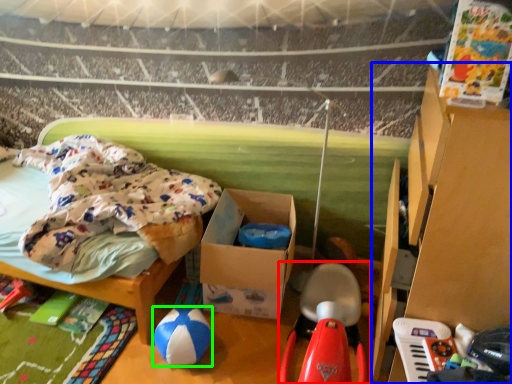
Question: Considering the real-world distances, which object is farthest from toy (highlighted by a red box)? furniture (highlighted by a blue box) or toy (highlighted by a green box)?

Choices:
 (A) furniture
 (B) toy

Answer: (B)